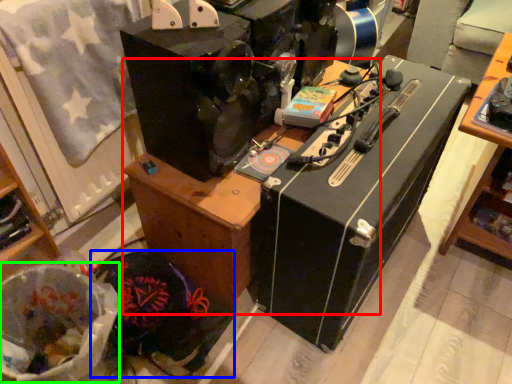
Question: Considering the real-world distances, which object is farthest from furniture (highlighted by a red box)? waste (highlighted by a blue box) or waste (highlighted by a green box)?

Choices:
 (A) waste
 (B) waste

Answer: (B)